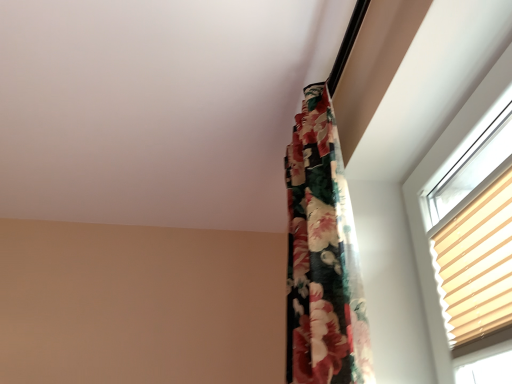
Question: Is beige pleated blind at upper right not near floral fabric curtain at upper right?

Choices:
 (A) no
 (B) yes

Answer: (A)

Question: Is beige pleated blind at upper right to the left of floral fabric curtain at upper right from the viewer's perspective?

Choices:
 (A) no
 (B) yes

Answer: (A)

Question: Considering the relative sizes of beige pleated blind at upper right and floral fabric curtain at upper right in the image provided, is beige pleated blind at upper right smaller than floral fabric curtain at upper right?

Choices:
 (A) yes
 (B) no

Answer: (A)

Question: Is beige pleated blind at upper right positioned beyond the bounds of floral fabric curtain at upper right?

Choices:
 (A) no
 (B) yes

Answer: (B)

Question: Considering the relative positions of beige pleated blind at upper right and floral fabric curtain at upper right in the image provided, is beige pleated blind at upper right behind floral fabric curtain at upper right?

Choices:
 (A) no
 (B) yes

Answer: (A)

Question: Is beige pleated blind at upper right oriented towards floral fabric curtain at upper right?

Choices:
 (A) no
 (B) yes

Answer: (A)

Question: From the image's perspective, is floral fabric curtain at upper right located beneath beige pleated blind at upper right?

Choices:
 (A) no
 (B) yes

Answer: (A)

Question: Is floral fabric curtain at upper right thinner than beige pleated blind at upper right?

Choices:
 (A) no
 (B) yes

Answer: (A)

Question: Could you tell me if floral fabric curtain at upper right is turned towards beige pleated blind at upper right?

Choices:
 (A) no
 (B) yes

Answer: (A)

Question: From a real-world perspective, does floral fabric curtain at upper right stand above beige pleated blind at upper right?

Choices:
 (A) no
 (B) yes

Answer: (B)

Question: Does floral fabric curtain at upper right have a lesser height compared to beige pleated blind at upper right?

Choices:
 (A) no
 (B) yes

Answer: (A)

Question: Is floral fabric curtain at upper right completely or partially outside of beige pleated blind at upper right?

Choices:
 (A) no
 (B) yes

Answer: (B)

Question: Looking at their shapes, would you say floral fabric curtain at upper right is wider or thinner than beige pleated blind at upper right?

Choices:
 (A) thin
 (B) wide

Answer: (B)